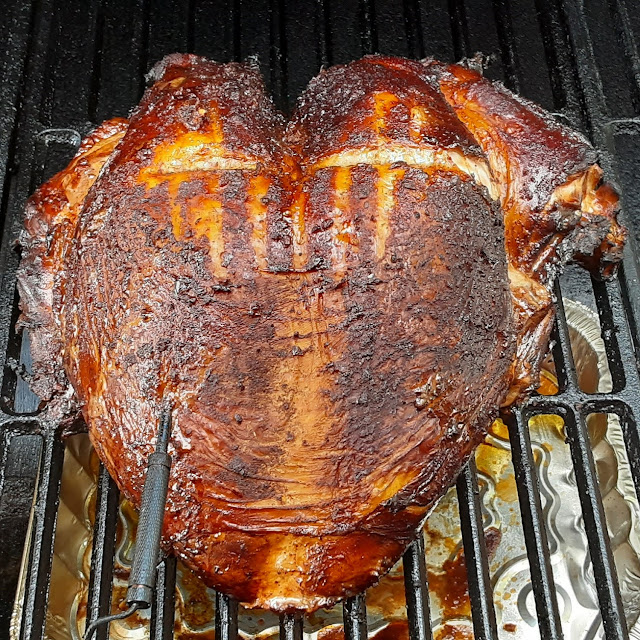
Find the location of a particular element. The width and height of the screenshot is (640, 640). digital thermometer insert is located at coordinates (164, 429).